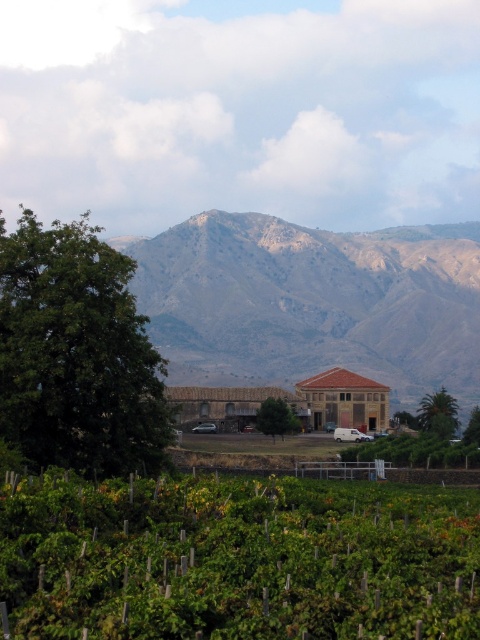
Question: Estimate the real-world distances between objects in this image. Which object is farther from the green leafy tree at lower right?

Choices:
 (A) green leafy palm at right
 (B) brown rocky mountain range at upper center
 (C) green leafy tree at center
 (D) green leafy tree at left

Answer: (B)

Question: Which object is the closest to the brown rocky mountain range at upper center?

Choices:
 (A) green leafy vineyard at lower center
 (B) green leafy tree at lower right
 (C) green leafy tree at center

Answer: (C)

Question: Can you confirm if green leafy palm at right is smaller than green leafy tree at lower right?

Choices:
 (A) no
 (B) yes

Answer: (A)

Question: Is green leafy vineyard at lower center further to the viewer compared to green leafy tree at left?

Choices:
 (A) no
 (B) yes

Answer: (A)

Question: Where is brown rocky mountain range at upper center located in relation to green leafy tree at lower right in the image?

Choices:
 (A) right
 (B) left

Answer: (B)

Question: Which of the following is the farthest from the observer?

Choices:
 (A) green leafy palm at right
 (B) green leafy tree at lower right
 (C) brown rocky mountain range at upper center

Answer: (C)